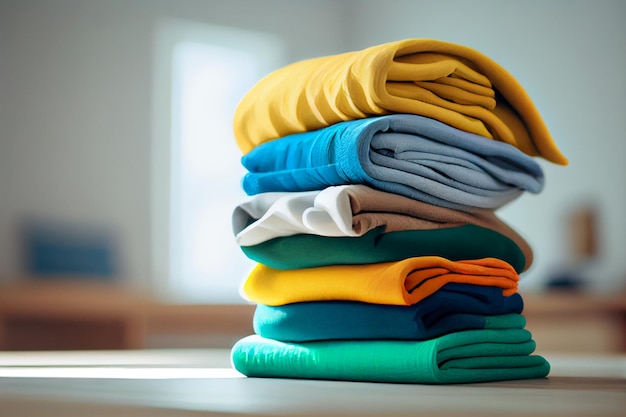
Locate an element on the screen. folded laundry is located at coordinates (346, 94), (352, 149), (322, 201), (345, 248), (367, 291), (362, 314), (316, 361).